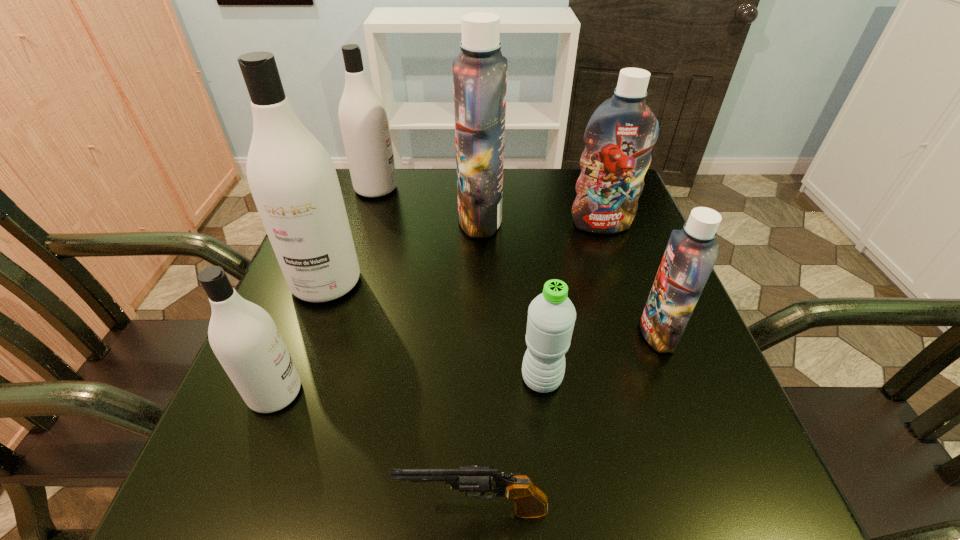
Where is `free spot between the smallest white shampoo and the water bottle`? This screenshot has width=960, height=540. free spot between the smallest white shampoo and the water bottle is located at coordinates coord(409,386).

Locate an element on the screen. This screenshot has height=540, width=960. empty space between the second biggest blue shampoo and the second farthest white shampoo is located at coordinates (464, 253).

The height and width of the screenshot is (540, 960). Find the location of `free space between the farthest white shampoo and the second nearest shampoo`. free space between the farthest white shampoo and the second nearest shampoo is located at coordinates (517, 261).

You are a GUI agent. You are given a task and a screenshot of the screen. Output one action in this format:
    pyautogui.click(x=<x>, y=<y>)
    Task: Click on the vacant region between the nearest blue shampoo and the second shortest object
    This screenshot has width=960, height=540.
    Given the screenshot: What is the action you would take?
    pyautogui.click(x=600, y=356)

Where is `free space between the smallest white shampoo and the shortest object`? free space between the smallest white shampoo and the shortest object is located at coordinates (375, 451).

This screenshot has height=540, width=960. In order to click on vacant point located between the nearest blue shampoo and the second biggest blue shampoo in this screenshot , I will do `click(630, 279)`.

At what (x,y) coordinates should I click in order to perform the action: click on free area in between the second nearest white shampoo and the smallest white shampoo. Please return your answer as a coordinate pair (x, y). Looking at the image, I should click on (300, 338).

I want to click on object that is the second closest to the fourth shampoo from left to right, so click(363, 118).

Identify which object is located as the fourth nearest to the second biggest white shampoo. Please provide its 2D coordinates. Your answer should be formatted as a tuple, i.e. [(x, y)], where the tuple contains the x and y coordinates of a point satisfying the conditions above.

[(243, 336)]

Find the location of a particular element. This screenshot has height=540, width=960. shampoo that can be found as the fourth closest to the second nearest white shampoo is located at coordinates (619, 137).